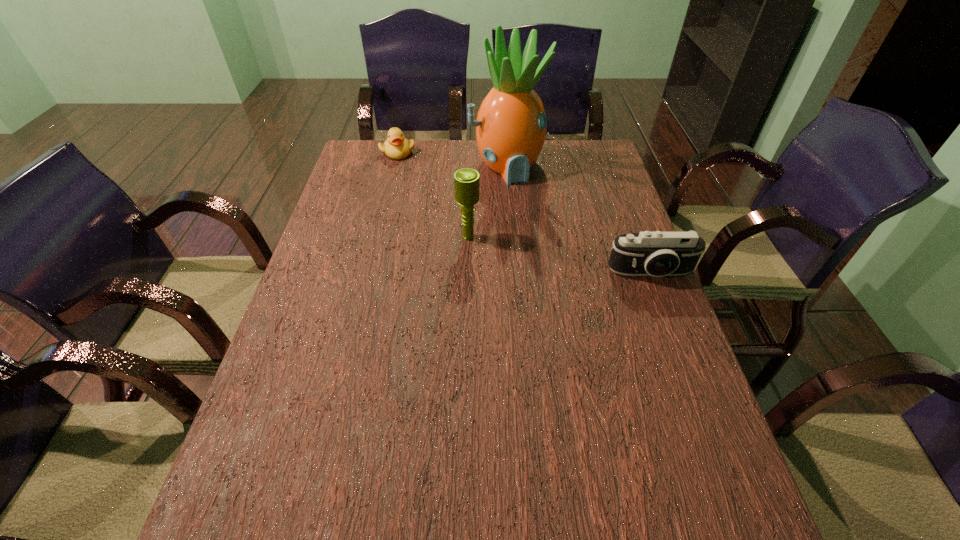
Locate an element on the screen. the third shortest object is located at coordinates (466, 181).

This screenshot has width=960, height=540. What are the coordinates of `the third farthest object` in the screenshot? It's located at (466, 181).

Find the location of a particular element. Image resolution: width=960 pixels, height=540 pixels. the rightmost object is located at coordinates (657, 254).

The width and height of the screenshot is (960, 540). In order to click on camera in this screenshot , I will do `click(657, 254)`.

The width and height of the screenshot is (960, 540). Find the location of `the tallest object`. the tallest object is located at coordinates (511, 125).

You are a GUI agent. You are given a task and a screenshot of the screen. Output one action in this format:
    pyautogui.click(x=<x>, y=<y>)
    Task: Click on the leftmost object
    Image resolution: width=960 pixels, height=540 pixels.
    Given the screenshot: What is the action you would take?
    pyautogui.click(x=397, y=147)

The height and width of the screenshot is (540, 960). Identify the location of the shortest object. (397, 147).

Locate an element on the screen. The height and width of the screenshot is (540, 960). free region located on the back of the third shortest object is located at coordinates (470, 161).

You are a GUI agent. You are given a task and a screenshot of the screen. Output one action in this format:
    pyautogui.click(x=<x>, y=<y>)
    Task: Click on the free space located on the front lens of the second shortest object
    This screenshot has height=540, width=960.
    Given the screenshot: What is the action you would take?
    pyautogui.click(x=685, y=362)

Locate an element on the screen. The height and width of the screenshot is (540, 960). vacant space located 0.090m at the entrance of the tallest object is located at coordinates (529, 201).